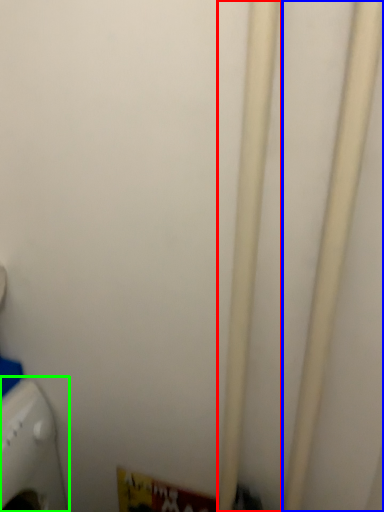
Question: Considering the real-world distances, which object is farthest from pipe (highlighted by a red box)? pipe (highlighted by a blue box) or home appliance (highlighted by a green box)?

Choices:
 (A) pipe
 (B) home appliance

Answer: (B)